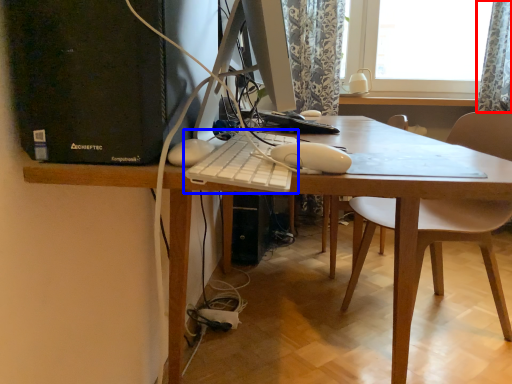
Question: Among these objects, which one is nearest to the camera, curtain (highlighted by a red box) or computer keyboard (highlighted by a blue box)?

Choices:
 (A) curtain
 (B) computer keyboard

Answer: (B)